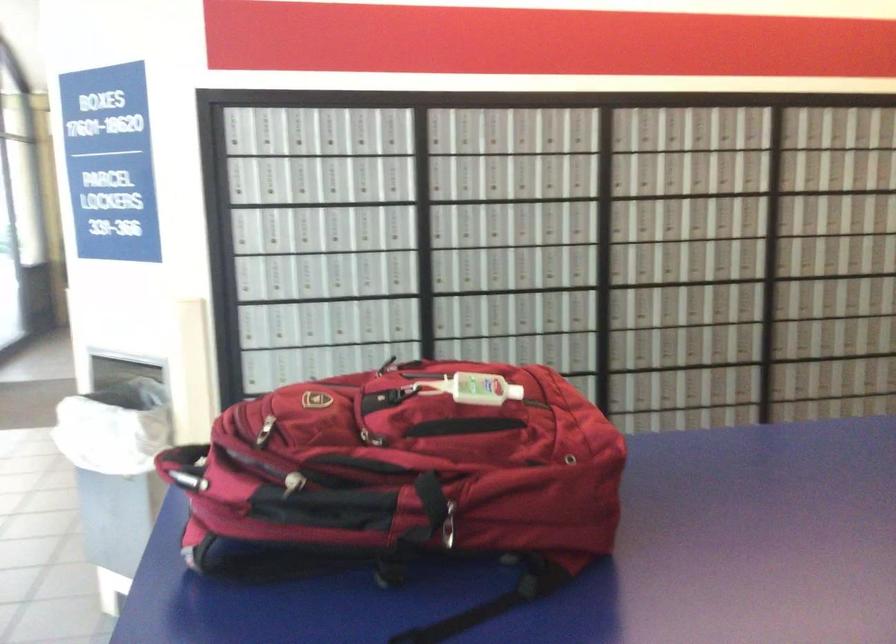
Image resolution: width=896 pixels, height=644 pixels. Describe the element at coordinates (185, 466) in the screenshot. I see `a black backpack handle` at that location.